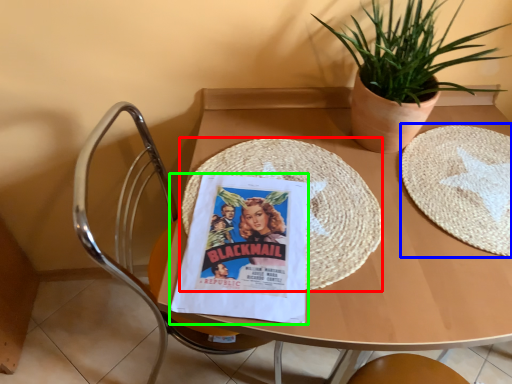
Question: Which object is the farthest from mat (highlighted by a red box)? Choose among these: paper plate (highlighted by a blue box) or comic book (highlighted by a green box).

Choices:
 (A) paper plate
 (B) comic book

Answer: (A)